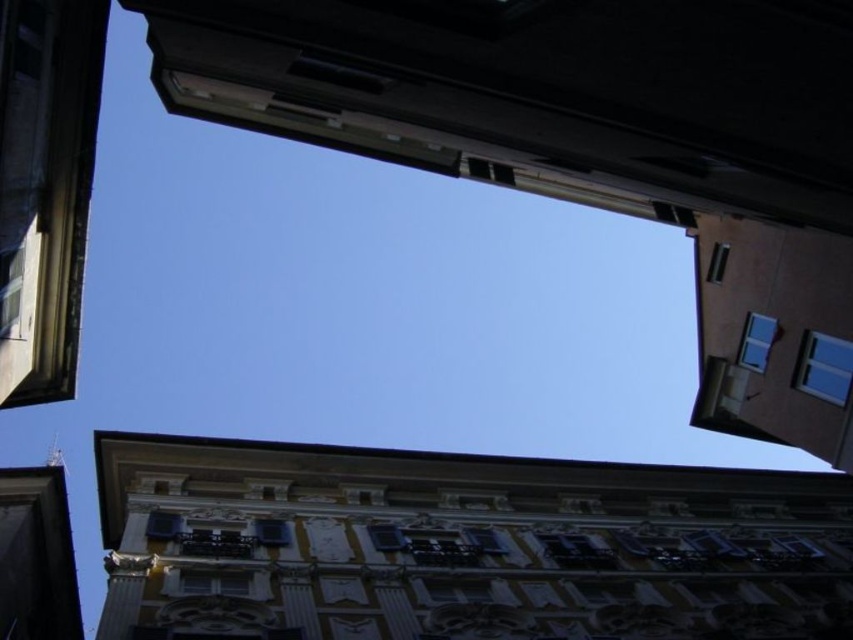
You are an architect analyzing the structural integrity of the white textured building at center and the metallic silver window at upper right. Based on their sizes, which one might require more support to withstand strong winds?

The white textured building at center is bigger than the metallic silver window at upper right, so it might require more support to withstand strong winds because larger structures typically need stronger support systems.

You are an architect analyzing the building structure. You notice two windows, the matte white window at center and the transparent glass window at center. Which window is located to the left when viewed from the street below?

The matte white window at center is positioned on the left side of the transparent glass window at center, so it is located to the left when viewed from the street below.